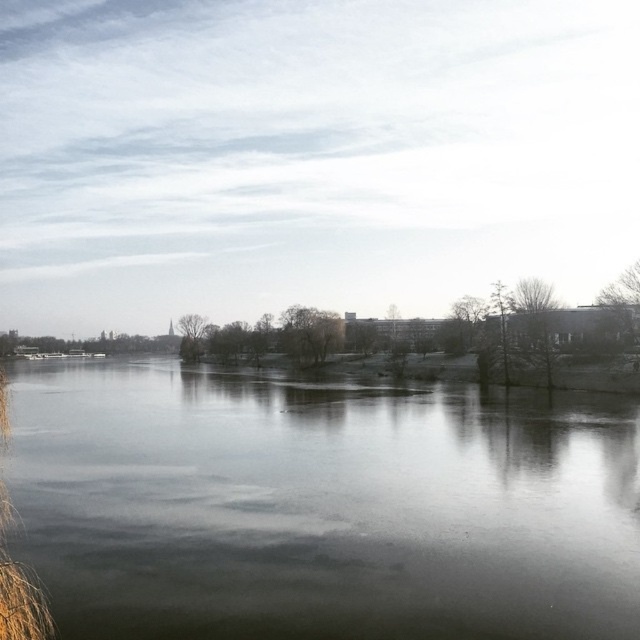
You are standing on the riverside path and want to take a photo of the dark reflective water at center and the brown grass at left. Which object should you focus on first if you want both to be in clear focus?

You should focus on the dark reflective water at center first because the brown grass at left is behind it, ensuring both will be in focus if you set the focus on the closer object.

You are standing at the riverside and want to walk from point A to point B. Point A is located at coordinate point [36,540] and point B is at coordinate point [20,636]. According to the image, which point is closer to you so you can start your journey?

Point A at coordinate point [36,540] is closer to you, so you can start your journey from there.